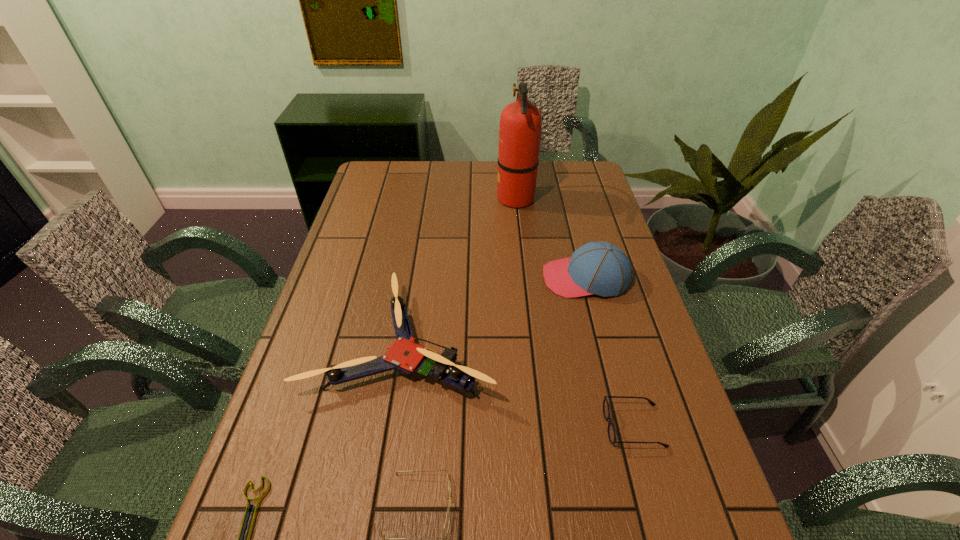
You are a GUI agent. You are given a task and a screenshot of the screen. Output one action in this format:
    pyautogui.click(x=<x>, y=<y>)
    Task: Click on the free space located 0.390m on the front-facing side of the second tallest object
    
    Given the screenshot: What is the action you would take?
    pyautogui.click(x=412, y=278)

Image resolution: width=960 pixels, height=540 pixels. Find the location of `vacant space located 0.110m on the right of the drone`. vacant space located 0.110m on the right of the drone is located at coordinates (537, 342).

Where is `free location located on the front-facing side of the farther spectacles`? free location located on the front-facing side of the farther spectacles is located at coordinates (569, 426).

You are a GUI agent. You are given a task and a screenshot of the screen. Output one action in this format:
    pyautogui.click(x=<x>, y=<y>)
    Task: Click on the free space located on the front-facing side of the farther spectacles
    
    Given the screenshot: What is the action you would take?
    pyautogui.click(x=488, y=426)

The height and width of the screenshot is (540, 960). Identify the location of vacant space located on the front-facing side of the farther spectacles. (496, 426).

This screenshot has height=540, width=960. In order to click on object that is at the far edge in this screenshot , I will do `click(520, 122)`.

I want to click on object that is at the left edge, so click(x=405, y=355).

Locate an element on the screen. Image resolution: width=960 pixels, height=540 pixels. baseball cap that is at the right edge is located at coordinates (598, 267).

Where is `spectacles at the right edge`? spectacles at the right edge is located at coordinates (606, 411).

Where is `vacant area at the far edge`? vacant area at the far edge is located at coordinates (489, 177).